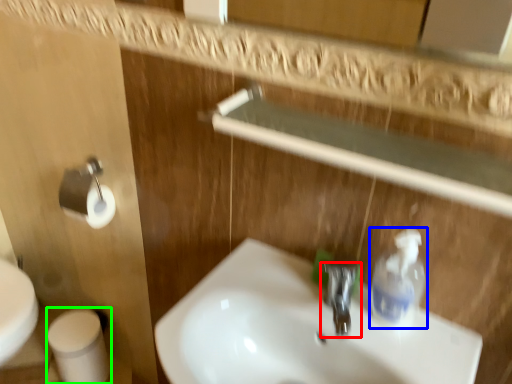
Question: Estimate the real-world distances between objects in this image. Which object is farther from tap (highlighted by a red box), cleaning product (highlighted by a blue box) or toilet paper (highlighted by a green box)?

Choices:
 (A) cleaning product
 (B) toilet paper

Answer: (B)